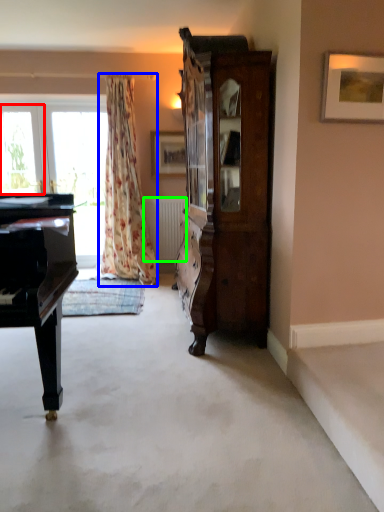
Question: Based on their relative distances, which object is nearer to window (highlighted by a red box)? Choose from curtain (highlighted by a blue box) and radiator (highlighted by a green box).

Choices:
 (A) curtain
 (B) radiator

Answer: (A)